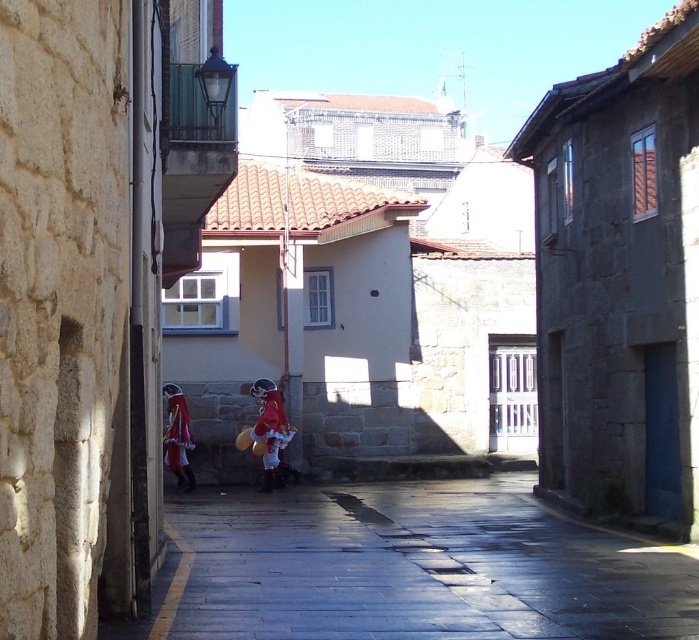
Is point (280, 429) closer to camera compared to point (173, 420)?

That is False.

Does red velvet santa claus at center appear over velvet red cape at center?

Incorrect, red velvet santa claus at center is not positioned above velvet red cape at center.

Is point (275, 392) farther from viewer compared to point (175, 456)?

That is True.

The image size is (699, 640). Find the location of `red velvet santa claus at center`. red velvet santa claus at center is located at coordinates click(x=271, y=433).

Describe the element at coordinates (419, 566) in the screenshot. The image size is (699, 640). I see `smooth stone pavement at center` at that location.

Is smooth stone pavement at center shorter than velvet red cape at center?

Yes.

Find the location of a particular element. This screenshot has height=640, width=699. smooth stone pavement at center is located at coordinates (419, 566).

This screenshot has width=699, height=640. What do you see at coordinates (419, 566) in the screenshot?
I see `smooth stone pavement at center` at bounding box center [419, 566].

Where is `smooth stone pavement at center`? This screenshot has width=699, height=640. smooth stone pavement at center is located at coordinates (419, 566).

Is point (345, 595) in front of point (275, 445)?

Yes, point (345, 595) is in front of point (275, 445).

You are a GUI agent. You are given a task and a screenshot of the screen. Output one action in this format:
    pyautogui.click(x=<x>, y=<y>)
    Task: Click on the smooth stone pavement at center
    
    Given the screenshot: What is the action you would take?
    pyautogui.click(x=419, y=566)